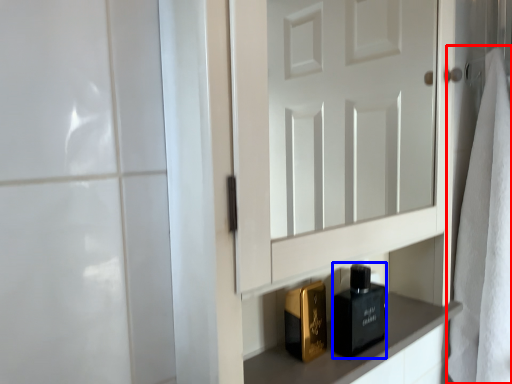
Question: Which object appears farthest to the camera in this image, bath towel (highlighted by a red box) or perfume (highlighted by a blue box)?

Choices:
 (A) bath towel
 (B) perfume

Answer: (A)